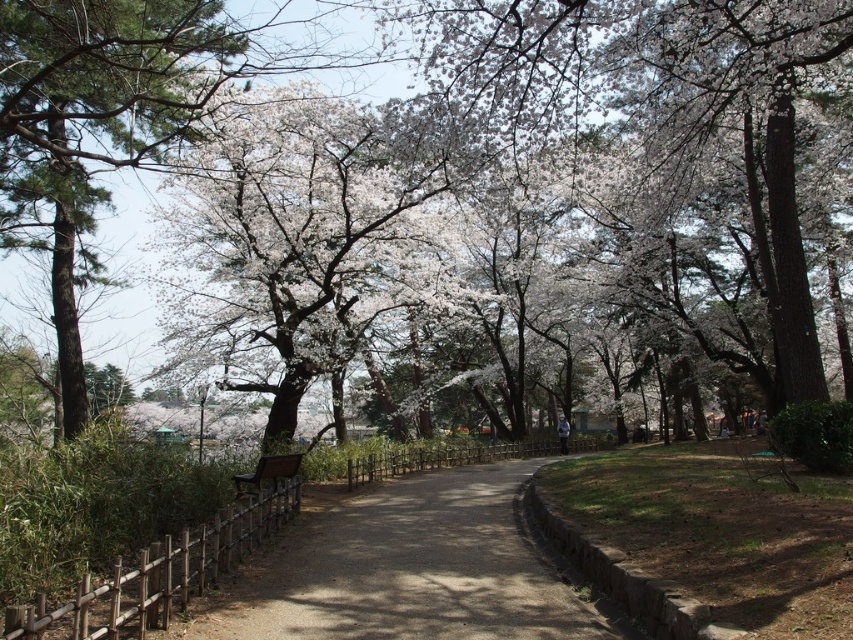
Is smooth bark tree at left wider than wooden bench at center?

Yes, smooth bark tree at left is wider than wooden bench at center.

Which is more to the left, smooth bark tree at left or wooden bench at center?

Positioned to the left is smooth bark tree at left.

Does point (82, 161) lie behind point (297, 464)?

Yes, it is behind point (297, 464).

At what (x,y) coordinates should I click in order to perform the action: click on smooth bark tree at left. Please return your answer as a coordinate pair (x, y). This screenshot has width=853, height=640. Looking at the image, I should click on (94, 125).

Which is below, white blossoming tree at center or brown gravel path at center?

Positioned lower is brown gravel path at center.

Which is behind, point (303, 280) or point (206, 632)?

The point (303, 280) is more distant.

Where is `white blossoming tree at center`? white blossoming tree at center is located at coordinates click(x=305, y=237).

Is white blossoms at center wider than brown gravel path at center?

Correct, the width of white blossoms at center exceeds that of brown gravel path at center.

How much distance is there between white blossoms at center and brown gravel path at center?

The distance of white blossoms at center from brown gravel path at center is 16.51 meters.

Who is more forward, [610,330] or [479,516]?

Point [479,516] is more forward.

Identify the location of white blossoms at center. Image resolution: width=853 pixels, height=640 pixels. (444, 193).